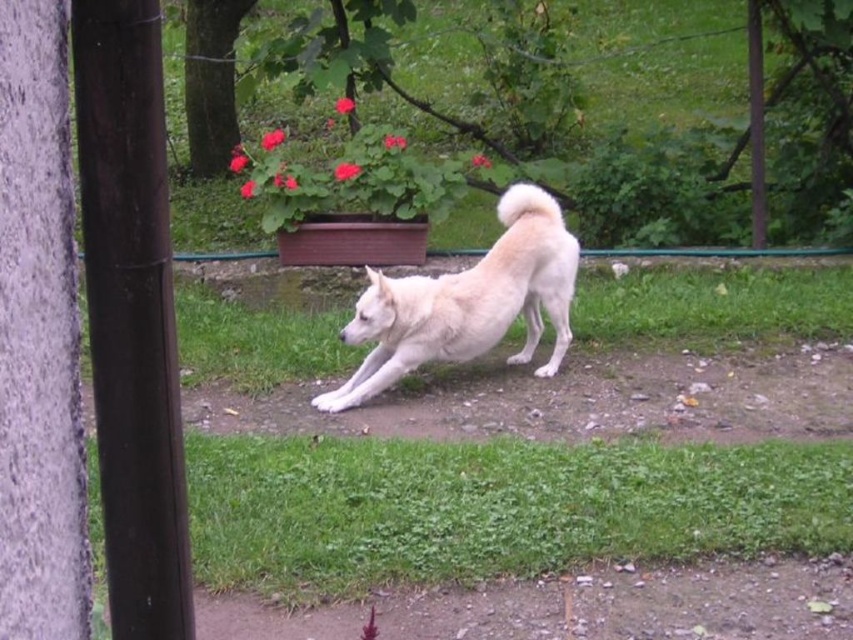
You are a photographer setting up a shot of the white fluffy dog at center and the green grass at lower center. Which object is wider in the image?

The green grass at lower center is wider than the white fluffy dog at center.

You are standing in the garden and want to pick a flower from the red flowerbed. To reach it, you need to step over an obstacle. Which object between the green grass at lower center and the white fluffy dog at center should you step over first?

You should step over the green grass at lower center first because it is closer to you than the white fluffy dog at center.